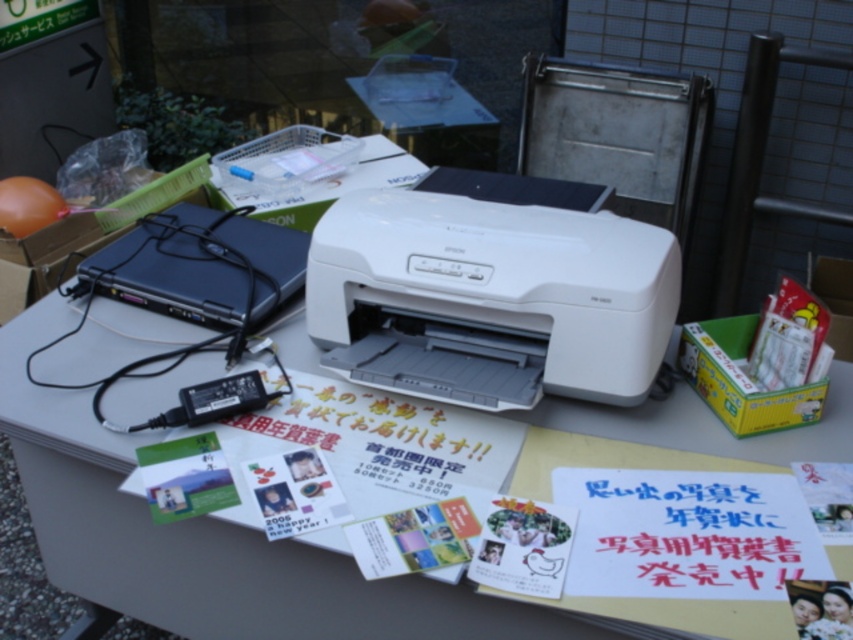
You are setting up for an event and need to stack the white plastic printer at center and the black plastic laptop at left on top of a shelf. Considering their heights, which one should you place at the bottom to ensure stability?

The white plastic printer at center is taller than the black plastic laptop at left, so to ensure stability, place the taller printer at the bottom and the shorter laptop on top.

You are organizing the materials on the table and notice the matte paper postcard at center and the green matte postcard at center. Which postcard is positioned lower on the table?

The matte paper postcard at center is positioned below the green matte postcard at center, so it is lower on the table.

You are organizing a community event and need to place a 12 inch wide decorative ribbon between the matte paper postcard at center and the green matte postcard at center. Will the ribbon fit between them without overlapping either postcard?

The matte paper postcard at center and the green matte postcard at center are 14.40 inches apart. Since the ribbon is 12 inches wide, it can fit between them without overlapping as 12 is less than 14.40.